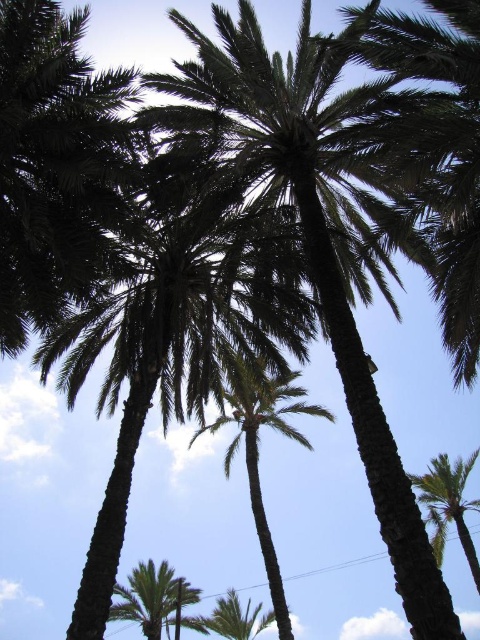
Consider the image. You are standing at the base of the dark green leafy palm tree at center and want to walk towards the green leafy palm tree at lower right. Which direction should you walk to reach it?

Since the green leafy palm tree at lower right is positioned to the side, you should walk towards the lower right direction to reach it.